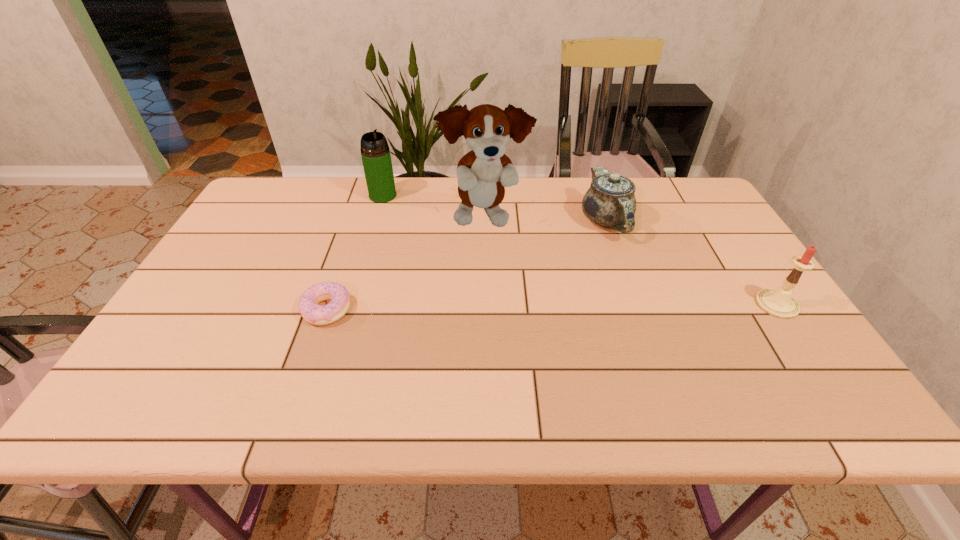
In order to click on vacant space on the desktop that is between the doughnut and the candle and is positioned on the face of the puppy in this screenshot , I will do `click(540, 307)`.

Where is `free space on the desktop that is between the shortest object and the rightmost object and is positioned from the spout of the thermos bottle`? free space on the desktop that is between the shortest object and the rightmost object and is positioned from the spout of the thermos bottle is located at coordinates (497, 307).

Identify the location of vacant space on the desktop that is between the doughnut and the rightmost object and is positioned from the spout of the second object from right to left. (619, 306).